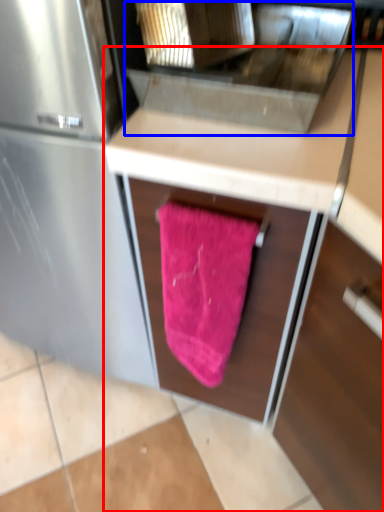
Question: Among these objects, which one is farthest to the camera, cabinetry (highlighted by a red box) or sink (highlighted by a blue box)?

Choices:
 (A) cabinetry
 (B) sink

Answer: (B)